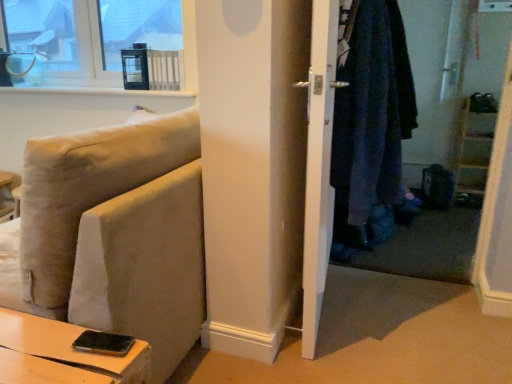
Question: Is white glossy door at center outside beige fabric couch at lower left?

Choices:
 (A) no
 (B) yes

Answer: (B)

Question: Is white glossy door at center shorter than beige fabric couch at lower left?

Choices:
 (A) no
 (B) yes

Answer: (A)

Question: Is white glossy door at center at the left side of beige fabric couch at lower left?

Choices:
 (A) no
 (B) yes

Answer: (A)

Question: From the image's perspective, is white glossy door at center above beige fabric couch at lower left?

Choices:
 (A) no
 (B) yes

Answer: (B)

Question: Is white glossy door at center turned away from beige fabric couch at lower left?

Choices:
 (A) yes
 (B) no

Answer: (A)

Question: Is white glossy door at center smaller than beige fabric couch at lower left?

Choices:
 (A) yes
 (B) no

Answer: (A)

Question: From the image's perspective, is beige fabric couch at lower left located beneath denim jacket at right?

Choices:
 (A) no
 (B) yes

Answer: (B)

Question: From a real-world perspective, is beige fabric couch at lower left on denim jacket at right?

Choices:
 (A) no
 (B) yes

Answer: (A)

Question: Is beige fabric couch at lower left placed right next to denim jacket at right?

Choices:
 (A) no
 (B) yes

Answer: (A)

Question: Considering the relative sizes of beige fabric couch at lower left and denim jacket at right in the image provided, is beige fabric couch at lower left thinner than denim jacket at right?

Choices:
 (A) yes
 (B) no

Answer: (B)

Question: Can you confirm if beige fabric couch at lower left is wider than denim jacket at right?

Choices:
 (A) no
 (B) yes

Answer: (B)

Question: Is beige fabric couch at lower left positioned beyond the bounds of denim jacket at right?

Choices:
 (A) no
 (B) yes

Answer: (B)

Question: Can you confirm if denim jacket at right is taller than beige fabric couch at lower left?

Choices:
 (A) yes
 (B) no

Answer: (A)